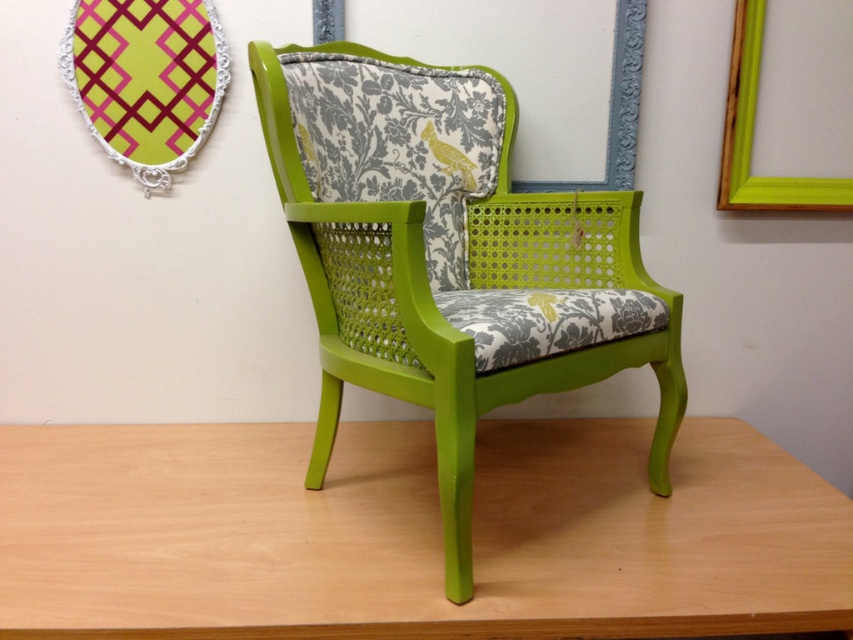
You are an interior designer arranging a living room. You have two frames to place on the wall. The matte plastic picture frame at upper left and the green matte picture frame at upper right. Which frame has a greater width?

The matte plastic picture frame at upper left has a greater width than the green matte picture frame at upper right.

Consider the image. You are arranging a small party in the room and need to place a centerpiece on the wooden table at center. However, you notice the matte plastic picture frame at upper left is hanging too low. To avoid blocking the view of the centerpiece from the doorway, should you move the picture frame up or down?

The wooden table at center is positioned on the right side of the matte plastic picture frame at upper left. Since the table is to the right of the frame, moving the picture frame up would place it higher on the wall, reducing the likelihood of blocking the view of the centerpiece from the doorway. Therefore, you should move the matte plastic picture frame at upper left upwards.

You are an interior designer assessing the space. You need to determine if the lime green cane armchair at center will fit under a standard ceiling height of 2.4 meters. The matte plastic picture frame at upper left is hanging at 2 meters from the floor. Can the armchair fit without hitting the ceiling?

The lime green cane cane armchair at center is much taller than the matte plastic picture frame at upper left, which is hanging at 2 meters from the floor. Since the chair is taller than the frame, it would exceed the 2.4 meter ceiling height and may hit the ceiling when moving it in.